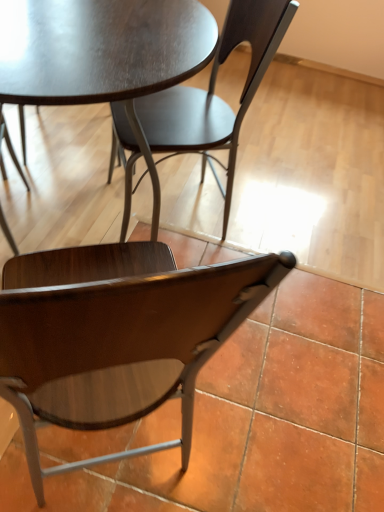
The width and height of the screenshot is (384, 512). Identify the location of free spot to the right of matte dark wood chair at center, the 2th chair ordered from the bottom. (276, 223).